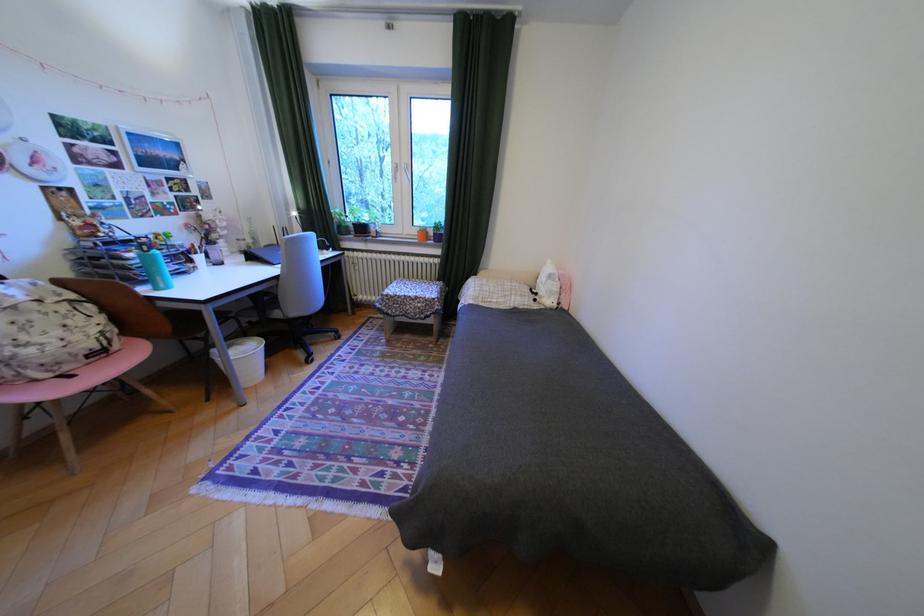
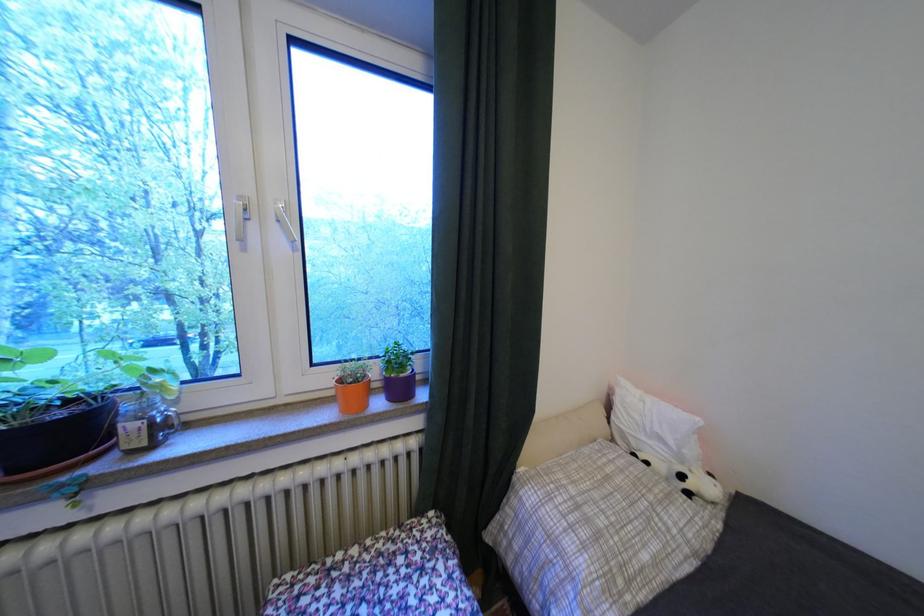
Locate, in the second image, the point that corresponds to (373,230) in the first image.

(75, 436)